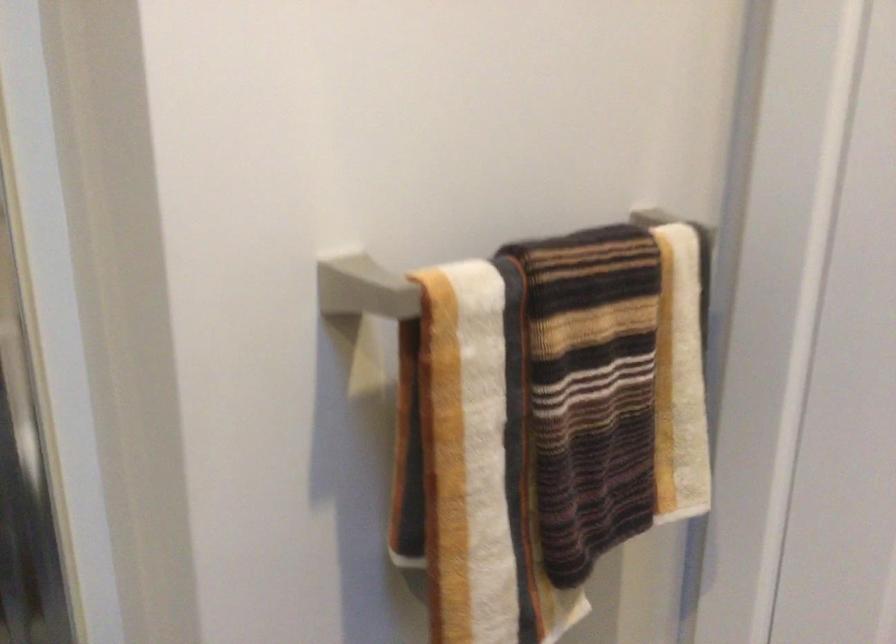
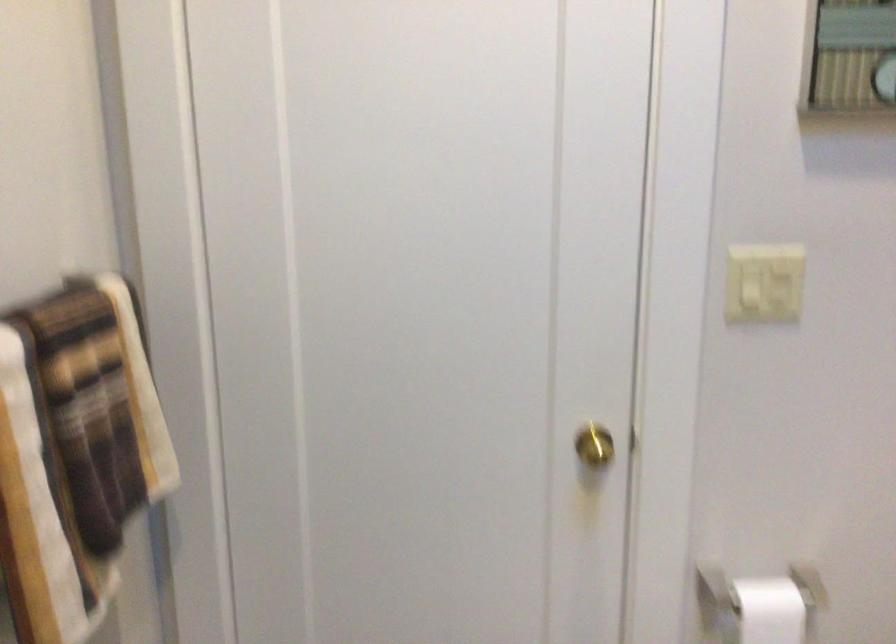
Question: The camera is either moving clockwise (left) or counter-clockwise (right) around the object. The first image is from the beginning of the video and the second image is from the end. Is the camera moving left or right when shooting the video?

Choices:
 (A) Left
 (B) Right

Answer: (A)